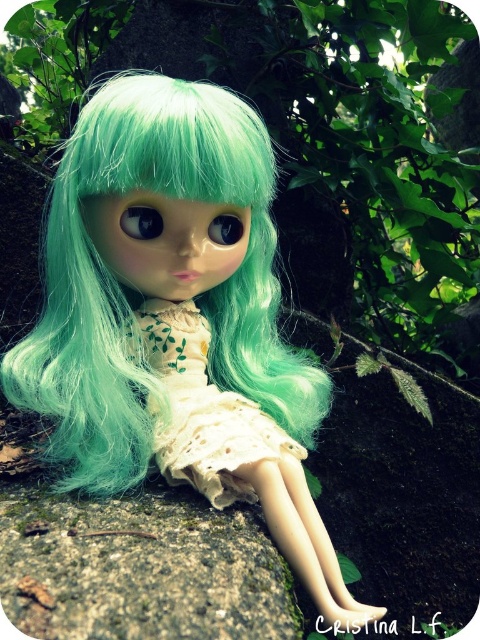
You are a photographer trying to capture a closeup of the green leafy tree at center and the white lace dress at center. Your camera can focus on objects within a 24 inch range. Can you focus on both objects at the same time?

The green leafy tree at center and white lace dress at center are 24.36 inches apart from each other. Since the camera can only focus within a 24 inch range, the distance between them exceeds the camera limit. Therefore, you cannot focus on both objects simultaneously.

You are a photographer setting up a shot of the doll in the scene. You need to ensure that the matte green wig at center and the green leafy tree at center are both visible in the frame. Which object should you focus on to ensure the smaller one is in focus?

The matte green wig at center has a smaller size compared to the green leafy tree at center, so you should focus on the matte green wig at center to ensure the smaller object is in focus.

You are a photographer setting up a shot of the green leafy tree at center and the white lace dress at center. Which object should you focus on first to ensure both are in sharp focus?

The green leafy tree at center is closer to the viewer than the white lace dress at center, so focus on the green leafy tree at center first to ensure both are in sharp focus.